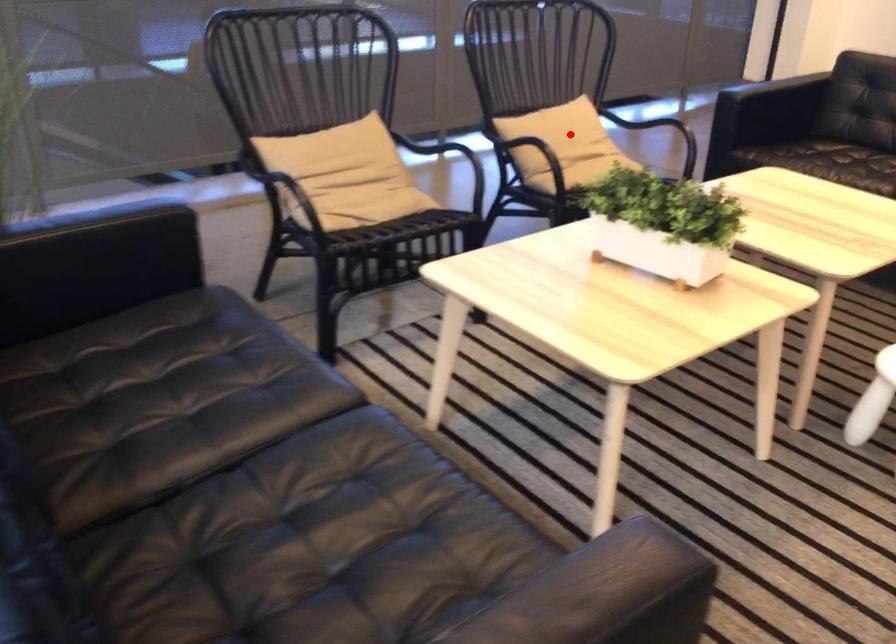
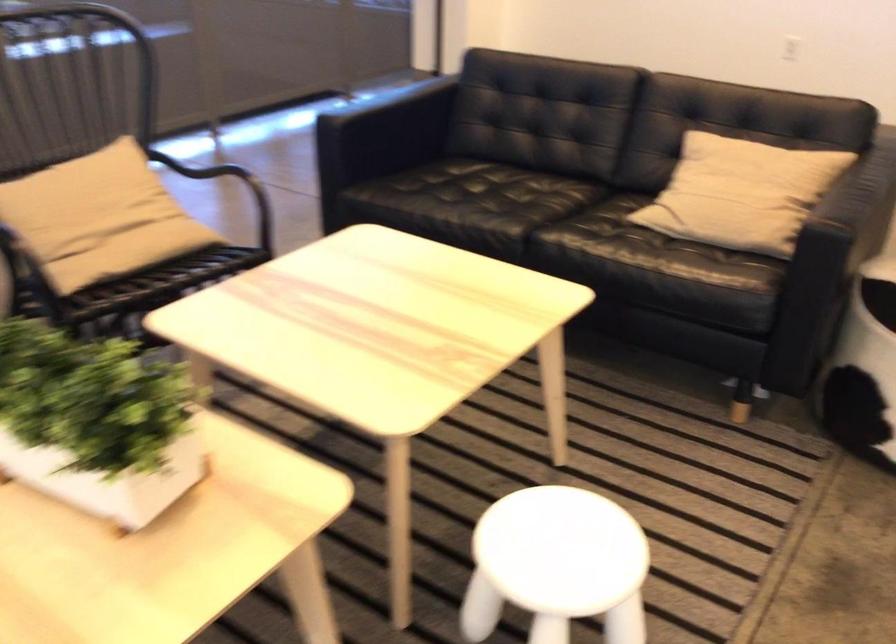
Question: I am providing you with two images of the same scene from different viewpoints. Given a red point in image1, look at the same physical point in image2. Is it:

Choices:
 (A) Closer to the viewpoint
 (B) Farther from the viewpoint

Answer: (A)